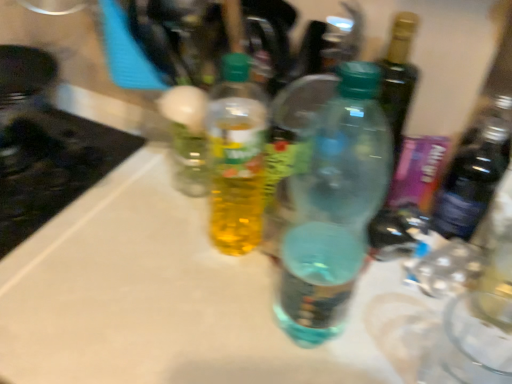
Find the location of a particular element. The image size is (512, 384). black glass stove at left is located at coordinates (51, 166).

What do you see at coordinates (51, 166) in the screenshot? The image size is (512, 384). I see `black glass stove at left` at bounding box center [51, 166].

At what (x,y) coordinates should I click in order to perform the action: click on translucent plastic bottle at center, positioned as the first bottle in left-to-right order. Please return your answer as a coordinate pair (x, y). The height and width of the screenshot is (384, 512). Looking at the image, I should click on (236, 157).

The width and height of the screenshot is (512, 384). Identify the location of translucent plastic bottle at center, acting as the 1th bottle starting from the right. (332, 206).

Would you say translucent plastic bottle at center, acting as the 1th bottle starting from the right, contains translucent plastic bottle at center, positioned as the first bottle in left-to-right order?

No, translucent plastic bottle at center, positioned as the first bottle in left-to-right order, is located outside of translucent plastic bottle at center, acting as the 1th bottle starting from the right.

Can you confirm if translucent plastic bottle at center, the second bottle from the left, is bigger than translucent plastic bottle at center, the second bottle when ordered from right to left?

Yes, translucent plastic bottle at center, the second bottle from the left, is bigger than translucent plastic bottle at center, the second bottle when ordered from right to left.

From the image's perspective, is translucent plastic bottle at center, the second bottle from the left, above translucent plastic bottle at center, positioned as the first bottle in left-to-right order?

No.

Who is shorter, translucent plastic bottle at center, positioned as the first bottle in left-to-right order, or translucent plastic bottle at center, the second bottle from the left?

translucent plastic bottle at center, positioned as the first bottle in left-to-right order.

Is translucent plastic bottle at center, positioned as the first bottle in left-to-right order, positioned far away from translucent plastic bottle at center, acting as the 1th bottle starting from the right?

No, translucent plastic bottle at center, positioned as the first bottle in left-to-right order, is in close proximity to translucent plastic bottle at center, acting as the 1th bottle starting from the right.

From the image's perspective, which is above, translucent plastic bottle at center, the second bottle when ordered from right to left, or translucent plastic bottle at center, the second bottle from the left?

translucent plastic bottle at center, the second bottle when ordered from right to left.

Considering the sizes of translucent plastic bottle at center, the second bottle from the left, and black glass stove at left in the image, is translucent plastic bottle at center, the second bottle from the left, bigger or smaller than black glass stove at left?

Clearly, translucent plastic bottle at center, the second bottle from the left, is smaller in size than black glass stove at left.

Which object is more forward, translucent plastic bottle at center, the second bottle from the left, or black glass stove at left?

translucent plastic bottle at center, the second bottle from the left, is in front.

Identify the location of appliance located behind the translucent plastic bottle at center, the second bottle from the left. The width and height of the screenshot is (512, 384). (51, 166).

Is translucent plastic bottle at center, acting as the 1th bottle starting from the right, beside black glass stove at left?

No.

In the scene shown: From a real-world perspective, does black glass stove at left stand above translucent plastic bottle at center, acting as the 1th bottle starting from the right?

No, from a real-world perspective, black glass stove at left is not on top of translucent plastic bottle at center, acting as the 1th bottle starting from the right.

Is black glass stove at left oriented away from translucent plastic bottle at center, the second bottle from the left?

No, black glass stove at left is not facing away from translucent plastic bottle at center, the second bottle from the left.

Is black glass stove at left to the left or to the right of translucent plastic bottle at center, acting as the 1th bottle starting from the right, in the image?

black glass stove at left is positioned on translucent plastic bottle at center, acting as the 1th bottle starting from the right,'s left side.

Which is behind, point (52, 148) or point (309, 238)?

The point (52, 148) is more distant.

Is translucent plastic bottle at center, positioned as the first bottle in left-to-right order, closer to camera compared to black glass stove at left?

Yes, it is in front of black glass stove at left.

Is translucent plastic bottle at center, the second bottle when ordered from right to left, not near black glass stove at left?

No, translucent plastic bottle at center, the second bottle when ordered from right to left, is in close proximity to black glass stove at left.

Is translucent plastic bottle at center, positioned as the first bottle in left-to-right order, to the left of black glass stove at left from the viewer's perspective?

Incorrect, translucent plastic bottle at center, positioned as the first bottle in left-to-right order, is not on the left side of black glass stove at left.

Does point (245, 96) lie in front of point (1, 163)?

Yes, point (245, 96) is closer to viewer.

Which is in front, black glass stove at left or translucent plastic bottle at center, positioned as the first bottle in left-to-right order?

Positioned in front is translucent plastic bottle at center, positioned as the first bottle in left-to-right order.

Consider the image. Is black glass stove at left far away from translucent plastic bottle at center, the second bottle when ordered from right to left?

A: That's not correct — black glass stove at left is a little close to translucent plastic bottle at center, the second bottle when ordered from right to left.

Consider the image. Is black glass stove at left bigger or smaller than translucent plastic bottle at center, the second bottle when ordered from right to left?

black glass stove at left is bigger than translucent plastic bottle at center, the second bottle when ordered from right to left.

You are a GUI agent. You are given a task and a screenshot of the screen. Output one action in this format:
    pyautogui.click(x=<x>, y=<y>)
    Task: Click on the bottle that is above the translucent plastic bottle at center, acting as the 1th bottle starting from the right (from the image's perspective)
    
    Given the screenshot: What is the action you would take?
    pyautogui.click(x=236, y=157)

Where is `bottle that appears on the left of translucent plastic bottle at center, the second bottle from the left`? The height and width of the screenshot is (384, 512). bottle that appears on the left of translucent plastic bottle at center, the second bottle from the left is located at coordinates (236, 157).

Based on their spatial positions, is black glass stove at left or translucent plastic bottle at center, acting as the 1th bottle starting from the right, closer to translucent plastic bottle at center, the second bottle when ordered from right to left?

translucent plastic bottle at center, acting as the 1th bottle starting from the right, lies closer to translucent plastic bottle at center, the second bottle when ordered from right to left, than the other object.

Based on their spatial positions, is translucent plastic bottle at center, the second bottle from the left, or translucent plastic bottle at center, the second bottle when ordered from right to left, further from black glass stove at left?

translucent plastic bottle at center, the second bottle from the left, is further to black glass stove at left.

Looking at the image, which one is located further to translucent plastic bottle at center, the second bottle when ordered from right to left, translucent plastic bottle at center, the second bottle from the left, or black glass stove at left?

Based on the image, black glass stove at left appears to be further to translucent plastic bottle at center, the second bottle when ordered from right to left.

From the image, which object appears to be nearer to black glass stove at left, translucent plastic bottle at center, the second bottle when ordered from right to left, or translucent plastic bottle at center, the second bottle from the left?

The object closer to black glass stove at left is translucent plastic bottle at center, the second bottle when ordered from right to left.

Based on their spatial positions, is black glass stove at left or translucent plastic bottle at center, positioned as the first bottle in left-to-right order, further from translucent plastic bottle at center, the second bottle from the left?

black glass stove at left is positioned further to the anchor translucent plastic bottle at center, the second bottle from the left.

Considering their positions, is translucent plastic bottle at center, positioned as the first bottle in left-to-right order, positioned further to translucent plastic bottle at center, the second bottle from the left, than black glass stove at left?

Based on the image, black glass stove at left appears to be further to translucent plastic bottle at center, the second bottle from the left.

The width and height of the screenshot is (512, 384). In order to click on bottle between black glass stove at left and translucent plastic bottle at center, acting as the 1th bottle starting from the right in this screenshot , I will do `click(236, 157)`.